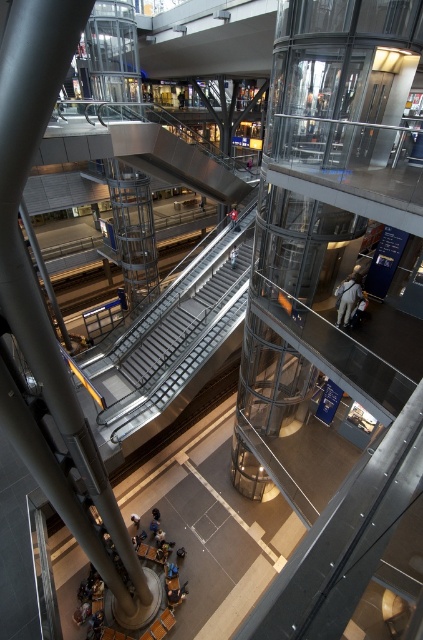
You are standing at the bottom of the escalator in the transportation hub and notice a light brown leather jacket at center and a white fabric person at center. Which object is closer to you?

The light brown leather jacket at center is closer to you because it is below the white fabric person at center.

You are standing at the entrance of the transportation hub and want to locate two specific points marked in the image. Which of the two points, point [162,380] or point [231,262], is closer to your current position?

Point [162,380] is closer to the camera than point [231,262], so it is closer to your current position.

You are standing at the entrance of the transportation hub and want to reach the first point you see. Which of the two points, point (147, 400) or point (231, 225), is closer to you?

Point (147, 400) is closer to the camera than point (231, 225), so it is the first point you see.